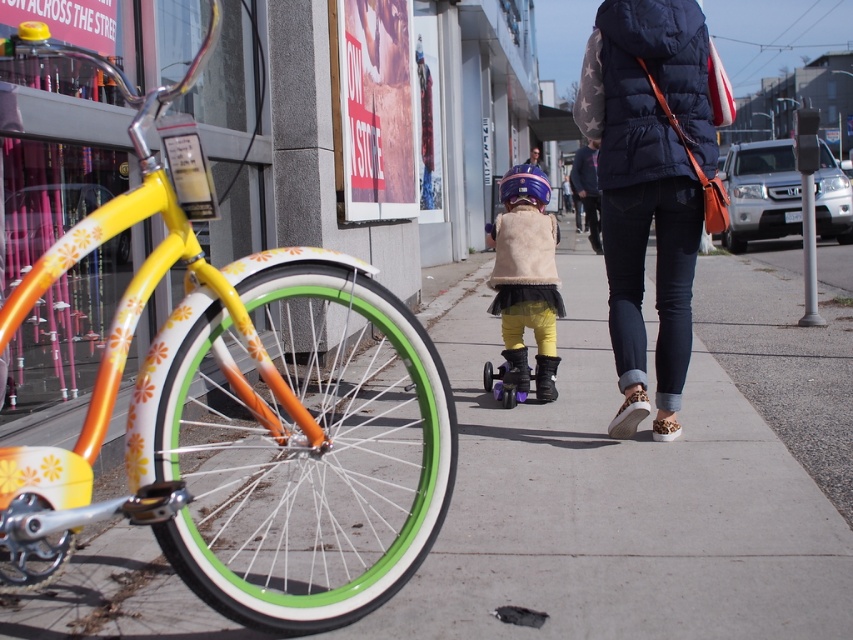
Question: Which of these objects is positioned farthest from the shiny yellow bicycle at left?

Choices:
 (A) purple matte roller skate at center
 (B) concrete sidewalk at center
 (C) dark blue puffer vest at center

Answer: (C)

Question: Among these points, which one is nearest to the camera?

Choices:
 (A) (682, 88)
 (B) (734, 573)

Answer: (B)

Question: Does concrete sidewalk at center appear on the left side of purple matte roller skate at center?

Choices:
 (A) yes
 (B) no

Answer: (B)

Question: From the image, what is the correct spatial relationship of beige faux fur vest at center in relation to purple matte roller skate at center?

Choices:
 (A) left
 (B) right

Answer: (B)

Question: Which of the following is the farthest from the observer?

Choices:
 (A) (502, 387)
 (B) (585, 278)
 (C) (619, 140)
 (D) (236, 259)

Answer: (B)

Question: Does concrete sidewalk at center appear on the left side of beige faux fur vest at center?

Choices:
 (A) no
 (B) yes

Answer: (A)